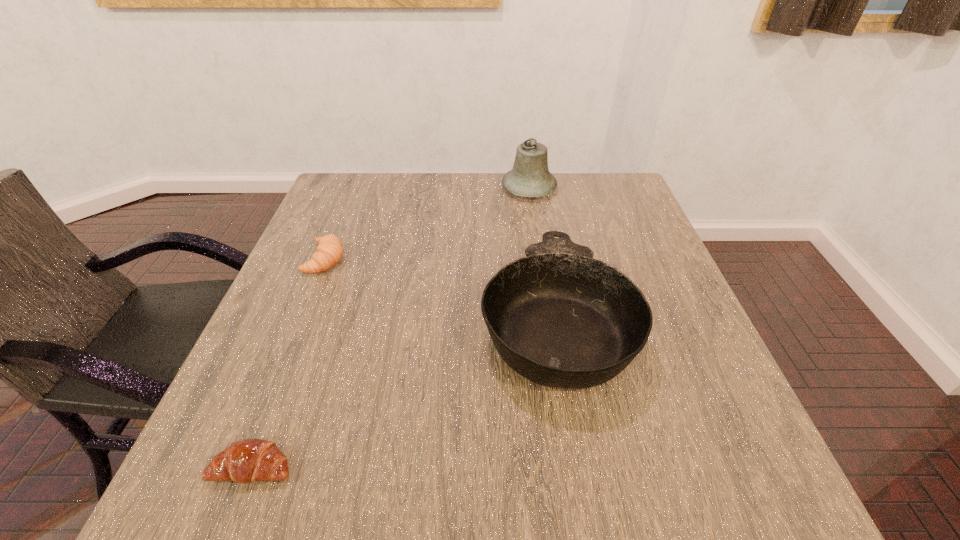
At what (x,y) coordinates should I click in order to perform the action: click on free space at the far right corner of the desktop. Please return your answer as a coordinate pair (x, y). This screenshot has height=540, width=960. Looking at the image, I should click on (604, 186).

Identify the location of free point between the nearer crescent roll and the farther crescent roll. The width and height of the screenshot is (960, 540). (290, 362).

Identify the location of free point between the farther crescent roll and the frying pan. (441, 289).

Identify the location of free space between the bell and the nearest object. (392, 327).

This screenshot has width=960, height=540. Identify the location of free space that is in between the shortest object and the third shortest object. (404, 393).

This screenshot has height=540, width=960. I want to click on vacant space in between the farther crescent roll and the third shortest object, so click(x=441, y=289).

Find the location of a particular element. free space that is in between the farther crescent roll and the bell is located at coordinates (427, 224).

Find the location of a particular element. The image size is (960, 540). vacant area that lies between the shorter crescent roll and the farther crescent roll is located at coordinates (290, 362).

This screenshot has height=540, width=960. I want to click on free spot between the shorter crescent roll and the farthest object, so click(392, 327).

Locate which object is the closest to the frying pan. Please provide its 2D coordinates. Your answer should be formatted as a tuple, i.e. [(x, y)], where the tuple contains the x and y coordinates of a point satisfying the conditions above.

[(530, 177)]